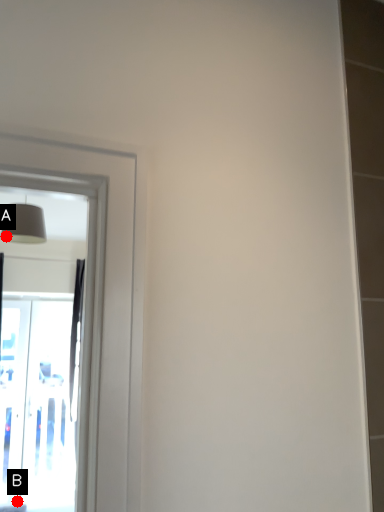
Question: Two points are circled on the image, labeled by A and B beside each circle. Among these points, which one is nearest to the camera?

Choices:
 (A) A is closer
 (B) B is closer

Answer: (A)